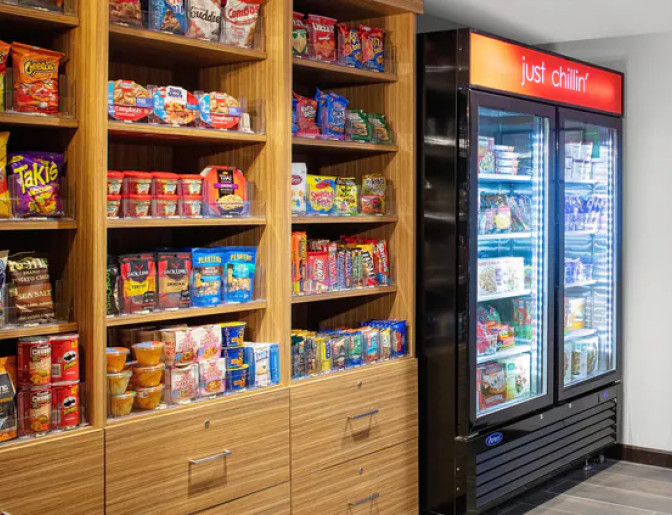
The width and height of the screenshot is (672, 515). Find the location of `brown baseboard`. brown baseboard is located at coordinates (653, 456).